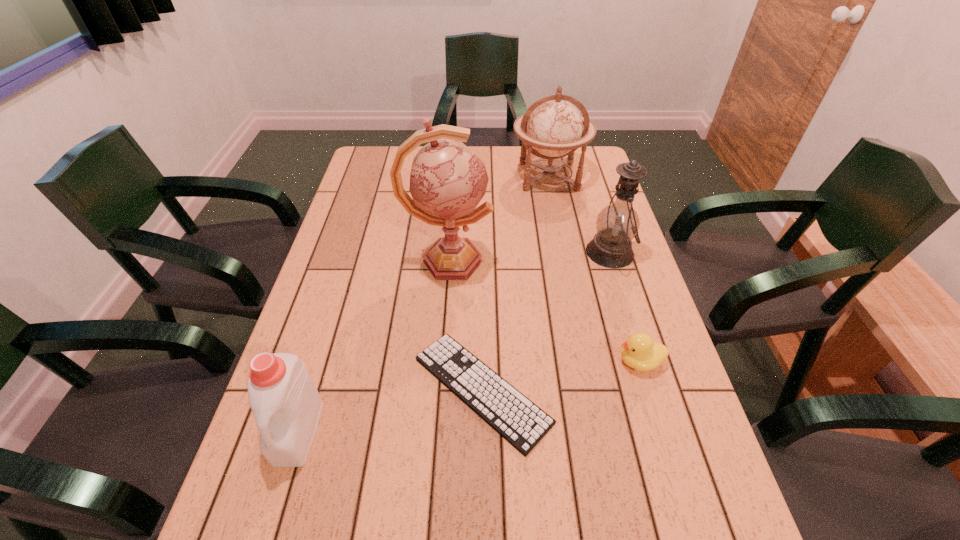
Image resolution: width=960 pixels, height=540 pixels. In order to click on oil lamp located at the right edge in this screenshot , I will do `click(617, 224)`.

Where is `duckling that is at the right edge`? This screenshot has width=960, height=540. duckling that is at the right edge is located at coordinates (640, 352).

What are the coordinates of `object that is at the far right corner` in the screenshot? It's located at (552, 125).

This screenshot has width=960, height=540. What are the coordinates of `vacant region at the left edge` in the screenshot? It's located at (367, 206).

The image size is (960, 540). In the image, there is a desktop. What are the coordinates of `vacant region at the right edge` in the screenshot? It's located at (656, 334).

I want to click on vacant space at the far left corner of the desktop, so click(364, 153).

Where is `vacant space at the far right corner`? The image size is (960, 540). vacant space at the far right corner is located at coordinates (602, 171).

Image resolution: width=960 pixels, height=540 pixels. Identify the location of vacant area that lies between the leftmost object and the computer keyboard. (390, 410).

Identify the location of vacant region between the left globe and the duckling. The height and width of the screenshot is (540, 960). (544, 311).

Where is `free area in between the fifth tallest object and the tallest object`? free area in between the fifth tallest object and the tallest object is located at coordinates (544, 311).